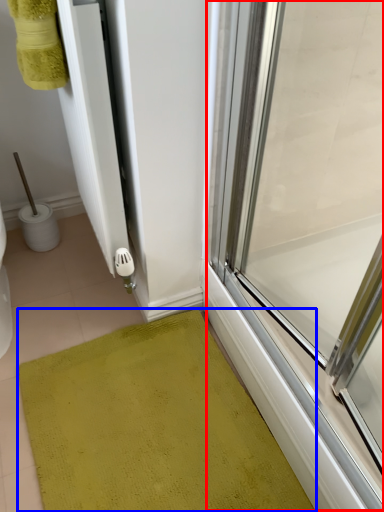
Question: Which of the following is the closest to the observer, glass door (highlighted by a red box) or bath mat (highlighted by a blue box)?

Choices:
 (A) glass door
 (B) bath mat

Answer: (A)